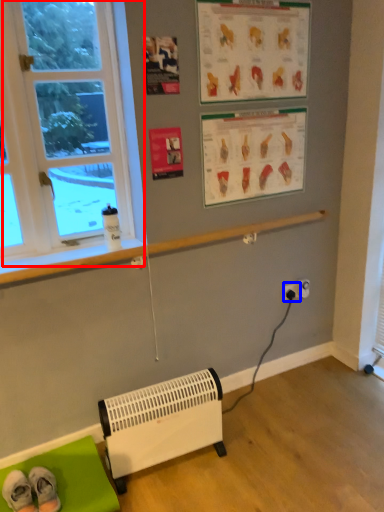
Question: Which point is further to the camera, window (highlighted by a red box) or electric outlet (highlighted by a blue box)?

Choices:
 (A) window
 (B) electric outlet

Answer: (B)